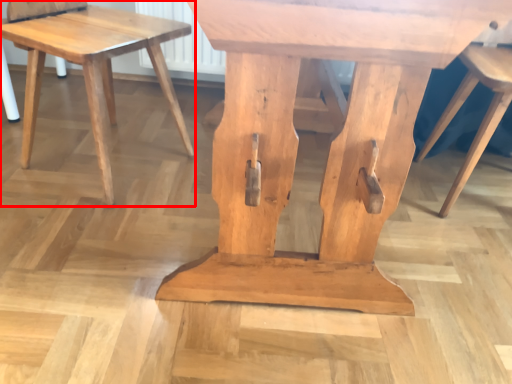
Question: Where is stool (annotated by the red box) located in relation to stool in the image?

Choices:
 (A) right
 (B) left

Answer: (B)